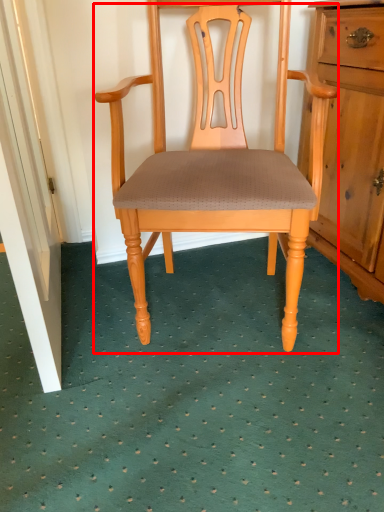
Question: In this image, where is chair (annotated by the red box) located relative to door?

Choices:
 (A) right
 (B) left

Answer: (A)